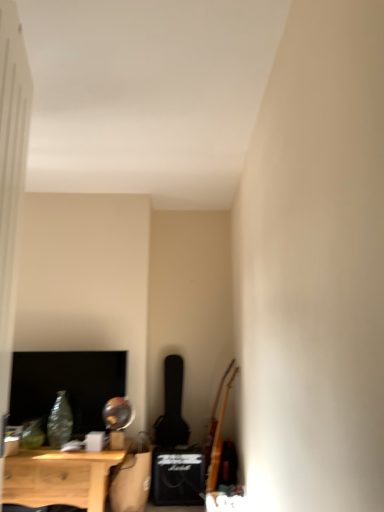
Question: Should I look upward or downward to see wooden acoustic guitar at right?

Choices:
 (A) up
 (B) down

Answer: (B)

Question: Is light wood nightstand at lower left turned away from wooden acoustic guitar at right?

Choices:
 (A) no
 (B) yes

Answer: (A)

Question: Can you confirm if light wood nightstand at lower left is shorter than wooden acoustic guitar at right?

Choices:
 (A) no
 (B) yes

Answer: (B)

Question: From the image's perspective, is light wood nightstand at lower left below wooden acoustic guitar at right?

Choices:
 (A) yes
 (B) no

Answer: (A)

Question: Is light wood nightstand at lower left to the right of wooden acoustic guitar at right from the viewer's perspective?

Choices:
 (A) no
 (B) yes

Answer: (A)

Question: Is light wood nightstand at lower left positioned before wooden acoustic guitar at right?

Choices:
 (A) yes
 (B) no

Answer: (A)

Question: Is light wood nightstand at lower left wider than wooden acoustic guitar at right?

Choices:
 (A) yes
 (B) no

Answer: (A)

Question: Is wooden acoustic guitar at right directly adjacent to light wood nightstand at lower left?

Choices:
 (A) yes
 (B) no

Answer: (B)

Question: Is wooden acoustic guitar at right in front of light wood nightstand at lower left?

Choices:
 (A) yes
 (B) no

Answer: (B)

Question: Can you confirm if wooden acoustic guitar at right is wider than light wood nightstand at lower left?

Choices:
 (A) yes
 (B) no

Answer: (B)

Question: Can you confirm if wooden acoustic guitar at right is smaller than light wood nightstand at lower left?

Choices:
 (A) no
 (B) yes

Answer: (B)

Question: Considering the relative sizes of wooden acoustic guitar at right and light wood nightstand at lower left in the image provided, is wooden acoustic guitar at right thinner than light wood nightstand at lower left?

Choices:
 (A) yes
 (B) no

Answer: (A)

Question: Considering the relative positions of wooden acoustic guitar at right and light wood nightstand at lower left in the image provided, is wooden acoustic guitar at right to the right of light wood nightstand at lower left from the viewer's perspective?

Choices:
 (A) no
 (B) yes

Answer: (B)

Question: Visually, is wooden acoustic guitar at right positioned to the left or to the right of light wood nightstand at lower left?

Choices:
 (A) right
 (B) left

Answer: (A)